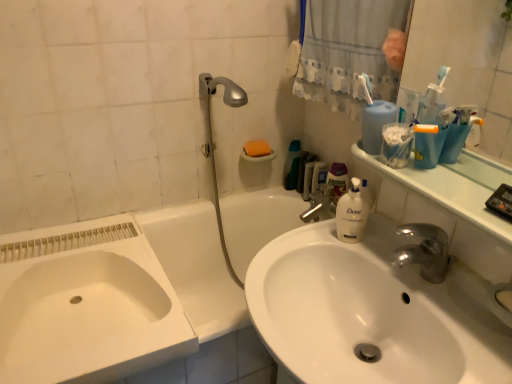
Image resolution: width=512 pixels, height=384 pixels. I want to click on green matte cleaning product at upper right, which ranks as the 1th cleaning product in left-to-right order, so click(292, 165).

What is the approximate height of green matte cleaning product at upper right, which ranks as the 1th cleaning product in left-to-right order?

The height of green matte cleaning product at upper right, which ranks as the 1th cleaning product in left-to-right order, is 8.87 inches.

The image size is (512, 384). In order to click on white glossy sink at upper right in this screenshot , I will do `click(454, 187)`.

Locate an element on the screen. This screenshot has width=512, height=384. orange sponge at upper center is located at coordinates (257, 148).

Describe the element at coordinates (257, 148) in the screenshot. I see `orange sponge at upper center` at that location.

I want to click on white fabric shower curtain at upper center, so 348,52.

At what (x,y) coordinates should I click in order to perform the action: click on white ceramic bathtub at lower left. Please return your answer as a coordinate pair (x, y). Image resolution: width=512 pixels, height=384 pixels. Looking at the image, I should click on (117, 299).

Would you say white plastic toothbrush at upper right contains white ceramic bathtub at lower left?

No, white ceramic bathtub at lower left is not surrounded by white plastic toothbrush at upper right.

From a real-world perspective, is white plastic toothbrush at upper right positioned over white ceramic bathtub at lower left based on gravity?

Yes, from a real-world perspective, white plastic toothbrush at upper right is over white ceramic bathtub at lower left

From the image's perspective, is white plastic toothbrush at upper right positioned above or below white ceramic bathtub at lower left?

From the image's perspective, white plastic toothbrush at upper right appears above white ceramic bathtub at lower left.

Find the location of a particular element. toothbrush located above the green matte cleaning product at upper right, the second cleaning product from the right (from a real-world perspective) is located at coordinates (367, 87).

Does white plastic toothbrush at upper right have a greater height compared to green matte cleaning product at upper right, which ranks as the 1th cleaning product in left-to-right order?

In fact, white plastic toothbrush at upper right may be shorter than green matte cleaning product at upper right, which ranks as the 1th cleaning product in left-to-right order.

Is white plastic toothbrush at upper right looking in the opposite direction of green matte cleaning product at upper right, which ranks as the 1th cleaning product in left-to-right order?

No, green matte cleaning product at upper right, which ranks as the 1th cleaning product in left-to-right order, is not at the back of white plastic toothbrush at upper right.

From the picture: Is white plastic toothbrush at upper right inside the boundaries of green matte cleaning product at upper right, which ranks as the 1th cleaning product in left-to-right order, or outside?

white plastic toothbrush at upper right is not inside green matte cleaning product at upper right, which ranks as the 1th cleaning product in left-to-right order, it's outside.

From the image's perspective, is orange sponge at upper center above or below white glossy sink at center, placed as the 2th sink when sorted from left to right?

From the image's perspective, orange sponge at upper center appears above white glossy sink at center, placed as the 2th sink when sorted from left to right.

Which is behind, point (250, 149) or point (286, 350)?

Point (250, 149)

From the image's perspective, which sink is the 2nd one below the orange sponge at upper center? Please provide its 2D coordinates.

[(371, 312)]

From the image's perspective, between white glossy sink at upper right and white glossy sink at lower left, acting as the 2th sink starting from the right, who is located below?

white glossy sink at lower left, acting as the 2th sink starting from the right.

In the image, is white glossy sink at upper right on the left side or the right side of white glossy sink at lower left, acting as the 2th sink starting from the right?

In the image, white glossy sink at upper right appears on the right side of white glossy sink at lower left, acting as the 2th sink starting from the right.

Is white glossy sink at lower left, acting as the 2th sink starting from the right, a part of white glossy sink at upper right?

No, white glossy sink at lower left, acting as the 2th sink starting from the right, is not inside white glossy sink at upper right.

Does white glossy sink at upper right have a lesser width compared to white glossy sink at lower left, acting as the 2th sink starting from the right?

Indeed, white glossy sink at upper right has a lesser width compared to white glossy sink at lower left, acting as the 2th sink starting from the right.

Is white glossy sink at center, which appears as the first sink when viewed from the right, shorter than white glossy sink at lower left, which is the first sink in left-to-right order?

No.

Is point (370, 302) closer or farther from the camera than point (121, 349)?

Clearly, point (370, 302) is more distant from the camera than point (121, 349).

How many degrees apart are the facing directions of white glossy sink at center, which appears as the first sink when viewed from the right, and white glossy sink at lower left, which is the first sink in left-to-right order?

90.7 degrees separate the facing orientations of white glossy sink at center, which appears as the first sink when viewed from the right, and white glossy sink at lower left, which is the first sink in left-to-right order.

Based on their sizes in the image, would you say white glossy sink at center, placed as the 2th sink when sorted from left to right, is bigger or smaller than white glossy sink at lower left, acting as the 2th sink starting from the right?

In the image, white glossy sink at center, placed as the 2th sink when sorted from left to right, appears to be larger than white glossy sink at lower left, acting as the 2th sink starting from the right.

There is a white fabric shower curtain at upper center. Where is `the 2nd sink below it (from a real-world perspective)`? Image resolution: width=512 pixels, height=384 pixels. the 2nd sink below it (from a real-world perspective) is located at coordinates (86, 305).

In terms of size, does white fabric shower curtain at upper center appear bigger or smaller than white glossy sink at lower left, which is the first sink in left-to-right order?

Answer: Considering their sizes, white fabric shower curtain at upper center takes up less space than white glossy sink at lower left, which is the first sink in left-to-right order.

Considering the sizes of objects white fabric shower curtain at upper center and white glossy sink at lower left, acting as the 2th sink starting from the right, in the image provided, who is taller, white fabric shower curtain at upper center or white glossy sink at lower left, acting as the 2th sink starting from the right,?

white fabric shower curtain at upper center.

Looking at this image, from the image's perspective, does white fabric shower curtain at upper center appear higher than white glossy sink at lower left, which is the first sink in left-to-right order?

Yes, from the image's perspective, white fabric shower curtain at upper center is on top of white glossy sink at lower left, which is the first sink in left-to-right order.

Locate an element on the screen. counter top that appears below the clear plastic mouthwash at center (from the image's perspective) is located at coordinates (454, 187).

Does point (404, 181) appear closer or farther from the camera than point (318, 177)?

Point (404, 181) is closer to the camera than point (318, 177).

From the image's perspective, which one is positioned higher, white glossy sink at upper right or clear plastic mouthwash at center?

clear plastic mouthwash at center.

Is white glossy sink at upper right not near clear plastic mouthwash at center?

No, there isn't a large distance between white glossy sink at upper right and clear plastic mouthwash at center.

Image resolution: width=512 pixels, height=384 pixels. I want to click on bathtub that appears below the white plastic toothbrush at upper right (from a real-world perspective), so click(x=117, y=299).

The height and width of the screenshot is (384, 512). Find the location of `cleaning product on the left of white plastic toothbrush at upper right`. cleaning product on the left of white plastic toothbrush at upper right is located at coordinates (292, 165).

When comparing their distances from white glossy sink at center, placed as the 2th sink when sorted from left to right, does white plastic toothbrush at upper right or white fabric shower curtain at upper center seem closer?

The object closer to white glossy sink at center, placed as the 2th sink when sorted from left to right, is white plastic toothbrush at upper right.

Based on their spatial positions, is white glossy sink at lower left, acting as the 2th sink starting from the right, or orange sponge at upper center further from white glossy sink at upper right?

orange sponge at upper center is positioned further to the anchor white glossy sink at upper right.

In the scene shown: Estimate the real-world distances between objects in this image. Which object is closer to white glossy sink at lower left, which is the first sink in left-to-right order, silver metallic showerhead at upper center or white glossy sink at upper right?

Among the two, silver metallic showerhead at upper center is located nearer to white glossy sink at lower left, which is the first sink in left-to-right order.

When comparing their distances from white ceramic bathtub at lower left, does orange sponge at upper center or white glossy sink at upper right seem further?

Among the two, white glossy sink at upper right is located further to white ceramic bathtub at lower left.

Looking at this image, based on their spatial positions, is white glossy sink at lower left, acting as the 2th sink starting from the right, or white ceramic bathtub at lower left further from white glossy sink at upper right?

white glossy sink at lower left, acting as the 2th sink starting from the right, lies further to white glossy sink at upper right than the other object.

Looking at this image, looking at the image, which one is located further to translucent plastic bottle at center, marked as the 1th cleaning product in a right-to-left arrangement, silver metallic showerhead at upper center or clear plastic mouthwash at center?

silver metallic showerhead at upper center.

Estimate the real-world distances between objects in this image. Which object is closer to orange sponge at upper center, white glossy sink at lower left, acting as the 2th sink starting from the right, or white ceramic bathtub at lower left?

The object closer to orange sponge at upper center is white ceramic bathtub at lower left.

Based on their spatial positions, is white glossy sink at lower left, acting as the 2th sink starting from the right, or orange sponge at upper center closer to white fabric shower curtain at upper center?

orange sponge at upper center is positioned closer to the anchor white fabric shower curtain at upper center.

Locate an element on the screen. This screenshot has height=384, width=512. plumbing fixture between white glossy sink at center, placed as the 2th sink when sorted from left to right, and green matte cleaning product at upper right, the second cleaning product from the right, along the z-axis is located at coordinates (214, 143).

The image size is (512, 384). What are the coordinates of `plumbing fixture between white glossy sink at lower left, acting as the 2th sink starting from the right, and white glossy sink at upper right, in the horizontal direction` in the screenshot? It's located at (214, 143).

At what (x,y) coordinates should I click in order to perform the action: click on cleaning product located between white fabric shower curtain at upper center and clear plastic mouthwash at center in the depth direction. Please return your answer as a coordinate pair (x, y). The height and width of the screenshot is (384, 512). Looking at the image, I should click on (338, 180).

Identify the location of plumbing fixture located between white glossy sink at upper right and clear plastic mouthwash at center in the depth direction. (214, 143).